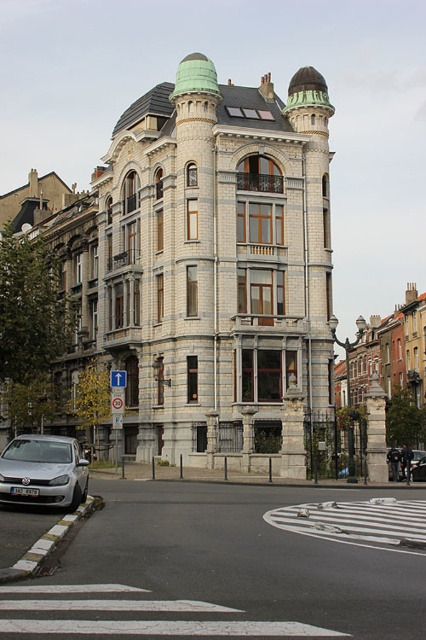
Is white asphalt at center above silver metallic car at lower left?

No.

Does white asphalt at center appear on the left side of silver metallic car at lower left?

In fact, white asphalt at center is to the right of silver metallic car at lower left.

Image resolution: width=426 pixels, height=640 pixels. Identify the location of white asphalt at center. (232, 566).

This screenshot has height=640, width=426. I want to click on white asphalt at center, so click(x=232, y=566).

Between point (14, 445) and point (416, 481), which one is positioned in front?

Point (14, 445)

Which is above, silver metallic car at lower left or metallic silver car at center?

silver metallic car at lower left

Where is `silver metallic car at lower left`? The image size is (426, 640). silver metallic car at lower left is located at coordinates (43, 472).

Does point (414, 522) come in front of point (420, 470)?

Yes, point (414, 522) is in front of point (420, 470).

Is white asphalt at center thinner than metallic silver car at center?

In fact, white asphalt at center might be wider than metallic silver car at center.

Who is more forward, (342,540) or (414,467)?

Point (342,540) is in front.

At what (x,y) coordinates should I click in order to perform the action: click on white asphalt at center. Please return your answer as a coordinate pair (x, y). Looking at the image, I should click on (232, 566).